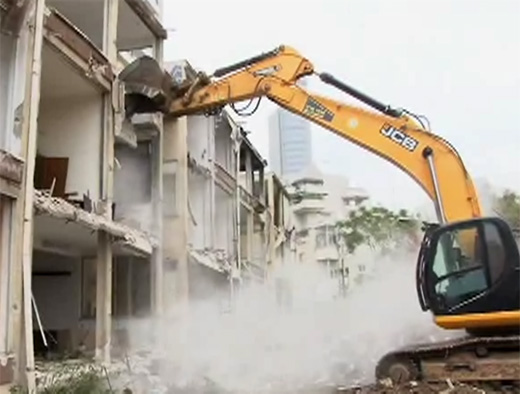
Locate an element on the screen. This screenshot has width=520, height=394. glass is located at coordinates (460, 246).